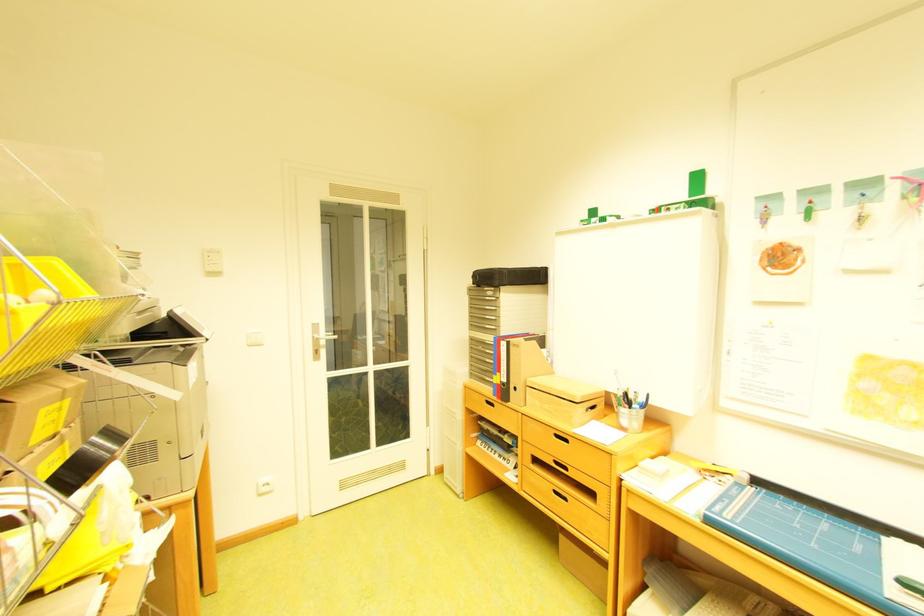
At what (x,y) coordinates should I click in order to perform the action: click on black tape roll. Please return your answer as a coordinate pair (x, y). Looking at the image, I should click on (509, 276).